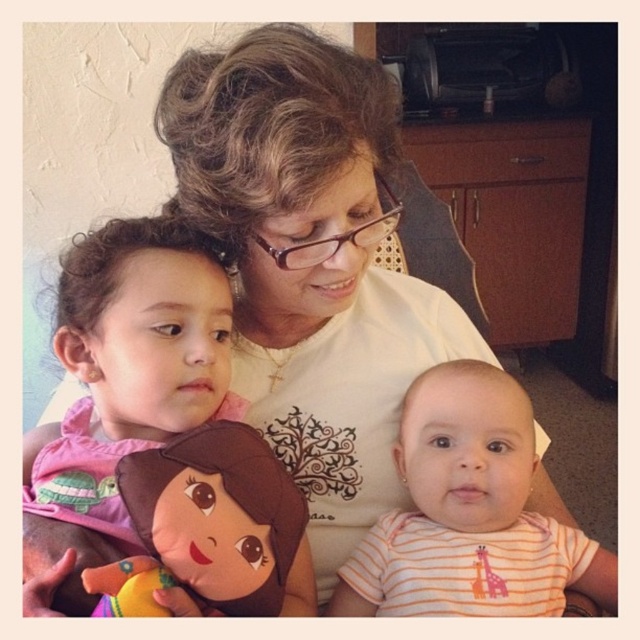
Question: Can you confirm if striped cotton baby at center is thinner than brown plush toy at center?

Choices:
 (A) yes
 (B) no

Answer: (B)

Question: Does brown plush toy at center come behind soft plush toy at center?

Choices:
 (A) no
 (B) yes

Answer: (B)

Question: Which object is farther from the camera taking this photo?

Choices:
 (A) soft plush toy at center
 (B) pink fabric doll at left

Answer: (B)

Question: Among these objects, which one is farthest from the camera?

Choices:
 (A) striped cotton baby at center
 (B) pink fabric doll at left

Answer: (A)

Question: Among these objects, which one is nearest to the camera?

Choices:
 (A) brown plush toy at center
 (B) striped cotton baby at center

Answer: (A)

Question: From the image, what is the correct spatial relationship of pink fabric doll at left in relation to soft plush toy at center?

Choices:
 (A) above
 (B) below

Answer: (A)